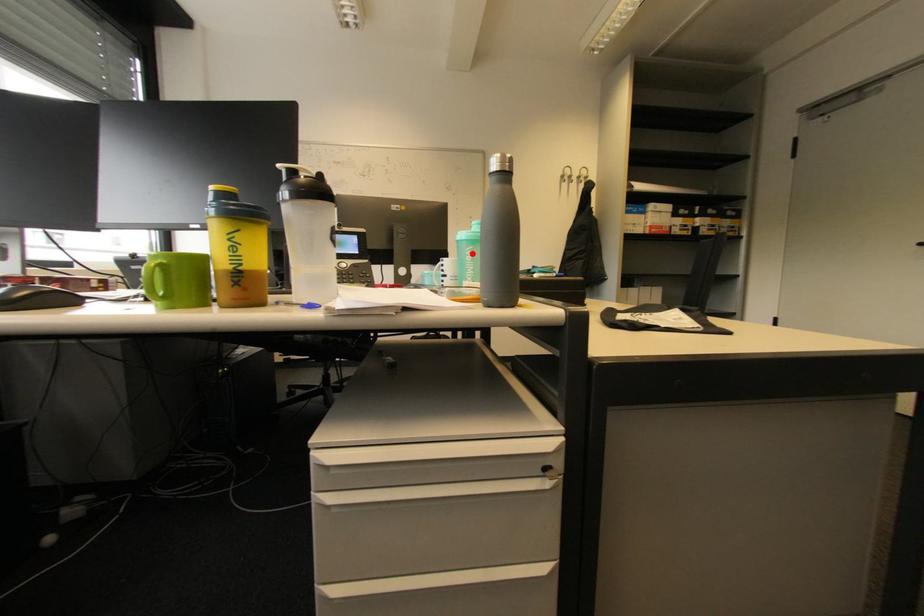
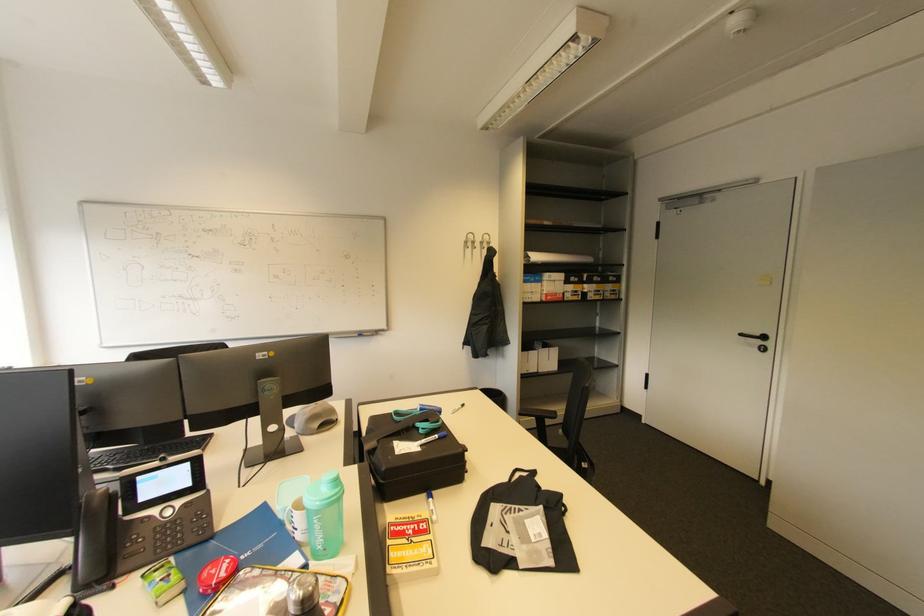
In the second image, find the point that corresponds to the highlighted location in the first image.

(320, 522)